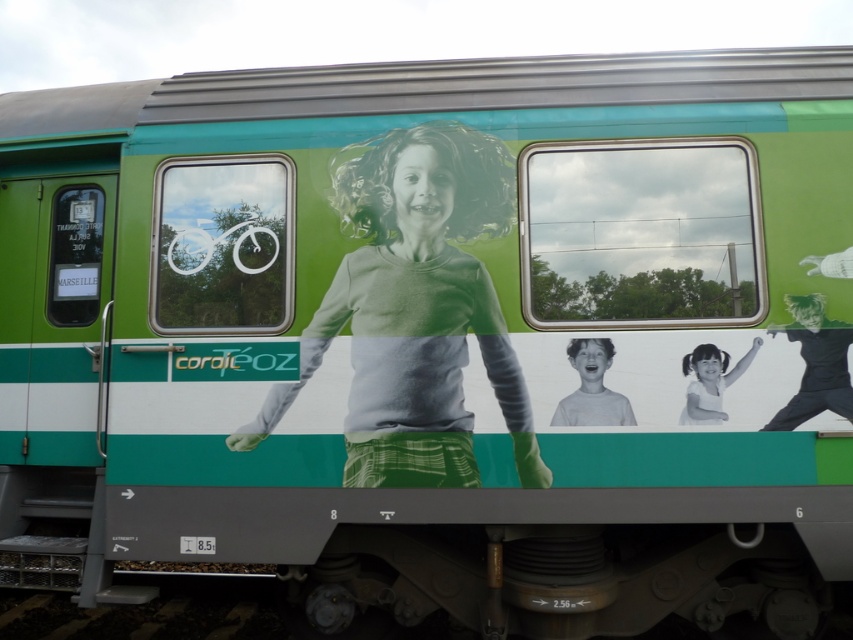
You are a fashion designer observing the advertisement on the train car. You notice the black matte shirt at right and the matte white face at center. Which object is located to the right of the other?

The black matte shirt at right is positioned on the right side of matte white face at center.

You are a passenger on the train and want to look at both the black matte shirt at right and the white paper at center. Which object should you look towards first if you start from the center of the train car?

You should look towards the white paper at center first because the black matte shirt at right is to the right of white paper at center, meaning the white paper is closer to the center of the train car.

You are a photographer trying to capture the young girl in the advertisement on the train car. You want to focus on her matte white face at center without the black matte shirt at right blocking the view. Is this possible given their positions?

The black matte shirt at right is positioned over the matte white face at center, so it will block the view of the matte white face at center. You cannot focus on the matte white face at center without the black matte shirt at right obstructing it.